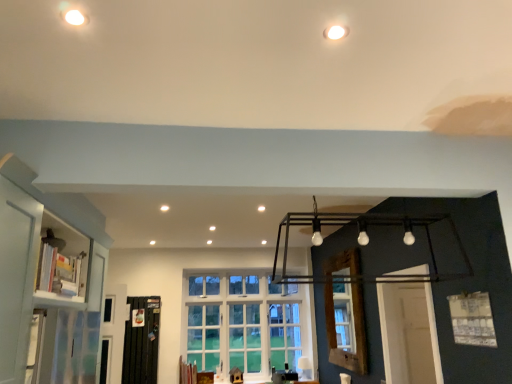
Question: Should I look upward or downward to see white glass window at center, which is the second window in front-to-back order?

Choices:
 (A) up
 (B) down

Answer: (B)

Question: Is white glass window at center, marked as the second window in a top-to-bottom arrangement, completely or partially outside of black metal screen door at lower left?

Choices:
 (A) yes
 (B) no

Answer: (A)

Question: From the image's perspective, is white glass window at center, which is the 2th window in right-to-left order, over black metal screen door at lower left?

Choices:
 (A) no
 (B) yes

Answer: (B)

Question: Is white glass window at center, the 1th window when ordered from back to front, facing away from black metal screen door at lower left?

Choices:
 (A) no
 (B) yes

Answer: (A)

Question: From a real-world perspective, is white glass window at center, marked as the second window in a top-to-bottom arrangement, positioned under black metal screen door at lower left based on gravity?

Choices:
 (A) yes
 (B) no

Answer: (B)

Question: Is white glass window at center, which is the 1th window in bottom-to-top order, shorter than black metal screen door at lower left?

Choices:
 (A) yes
 (B) no

Answer: (B)

Question: Is white glass window at center, the first window in the left-to-right sequence, smaller than black metal screen door at lower left?

Choices:
 (A) no
 (B) yes

Answer: (A)

Question: Is wooden window frame at center to the right of white matte window at upper center, which is the 2th window in bottom-to-top order, from the viewer's perspective?

Choices:
 (A) no
 (B) yes

Answer: (A)

Question: Is wooden window frame at center outside of white matte window at upper center, which is the first window from top to bottom?

Choices:
 (A) yes
 (B) no

Answer: (A)

Question: Is wooden window frame at center bigger than white matte window at upper center, arranged as the first window when viewed from the right?

Choices:
 (A) no
 (B) yes

Answer: (B)

Question: Is wooden window frame at center surrounding white matte window at upper center, which appears as the first window when viewed from the front?

Choices:
 (A) no
 (B) yes

Answer: (A)

Question: Can you confirm if wooden window frame at center is wider than white matte window at upper center, placed as the 2th window when sorted from left to right?

Choices:
 (A) no
 (B) yes

Answer: (B)

Question: Is wooden window frame at center smaller than white matte window at upper center, placed as the 2th window when sorted from left to right?

Choices:
 (A) yes
 (B) no

Answer: (B)

Question: Is black metal screen door at lower left further to camera compared to white glass window at center, marked as the second window in a top-to-bottom arrangement?

Choices:
 (A) yes
 (B) no

Answer: (B)